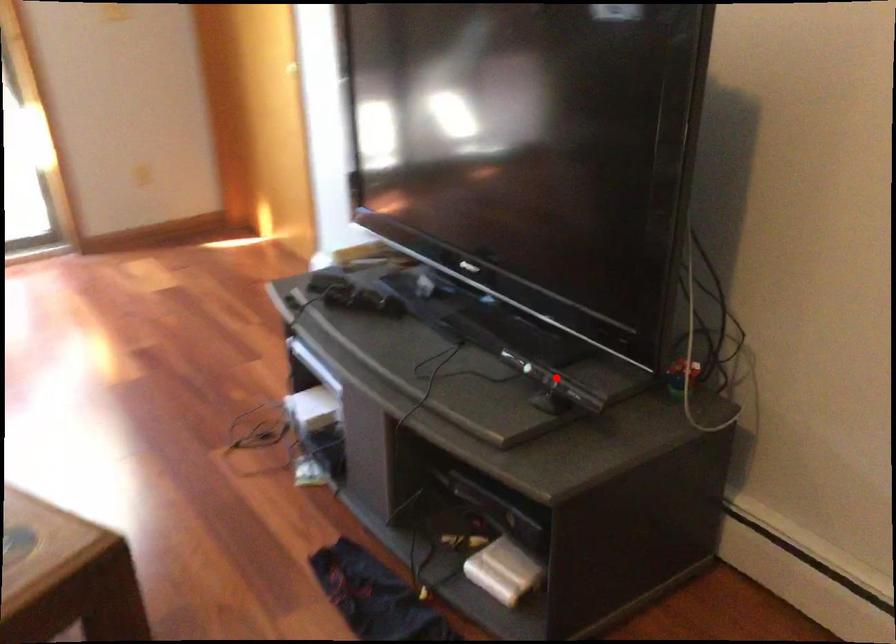
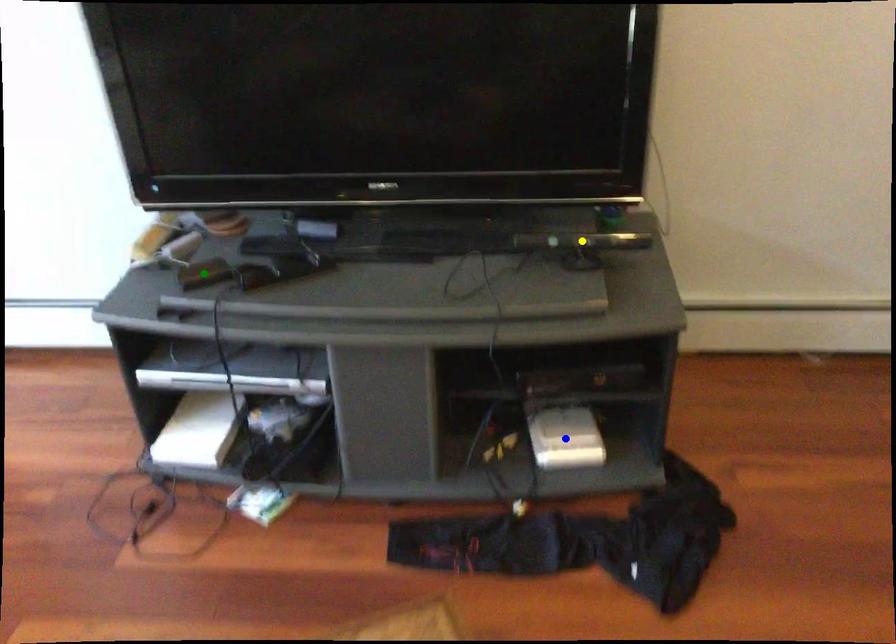
Question: I am providing you with two images of the same scene from different viewpoints. A red point is marked on the first image. You are given multiple points on the second image. In image 2, which mark is for the same physical point as the one in image 1?

Choices:
 (A) blue point
 (B) green point
 (C) yellow point

Answer: (C)